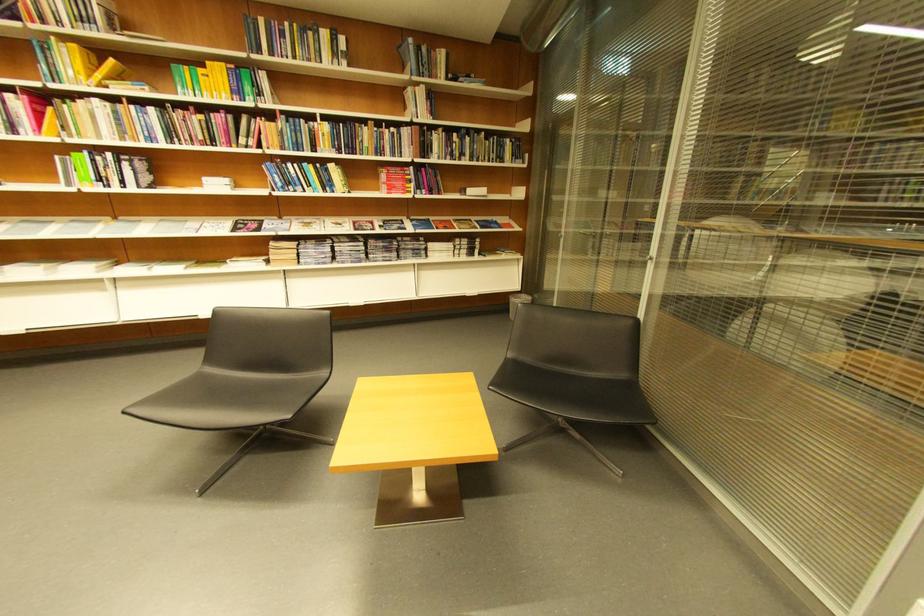
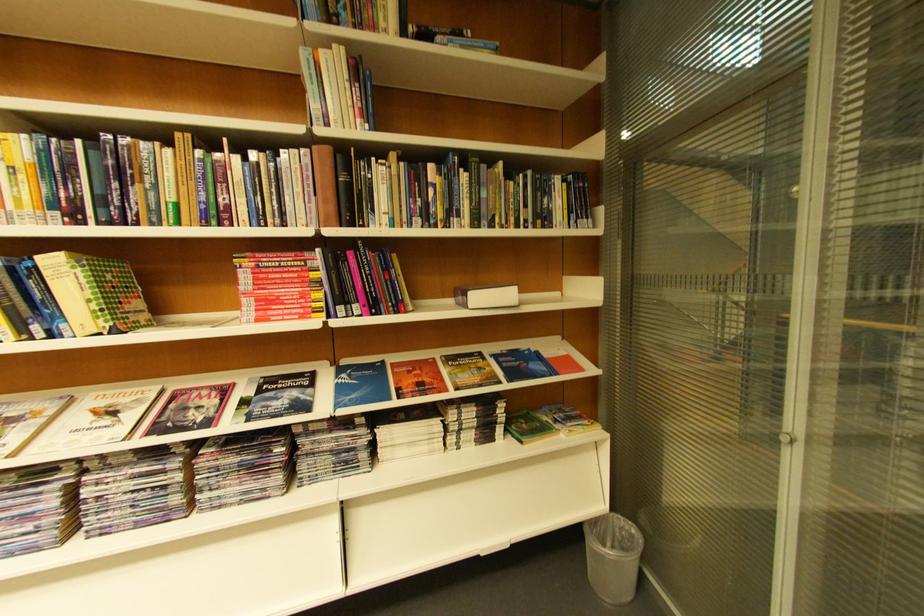
Where in the second image is the point corresponding to (x=377, y=223) from the first image?

(224, 389)